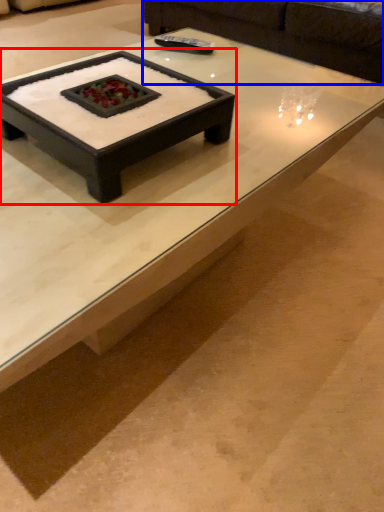
Question: Which object is closer to the camera taking this photo, coffee table (highlighted by a red box) or couch (highlighted by a blue box)?

Choices:
 (A) coffee table
 (B) couch

Answer: (A)